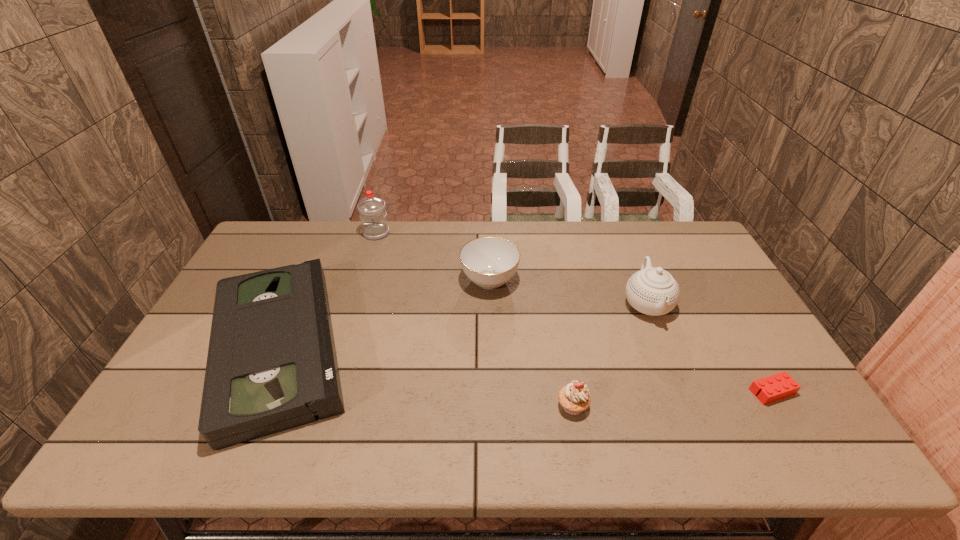
Locate an element on the screen. The height and width of the screenshot is (540, 960). object that is at the near left corner is located at coordinates coord(271,366).

Locate an element on the screen. vacant space at the far edge of the desktop is located at coordinates (419, 252).

This screenshot has height=540, width=960. I want to click on free space at the near edge, so click(x=305, y=449).

Where is `free space at the left edge`? free space at the left edge is located at coordinates (204, 383).

Where is `vacant space at the right edge of the desktop`? vacant space at the right edge of the desktop is located at coordinates (709, 313).

The width and height of the screenshot is (960, 540). Identify the location of free space between the fourth object from left to right and the right chinaware. (610, 355).

At what (x,y) coordinates should I click in order to perform the action: click on free space between the fifth tallest object and the water bottle. Please return your answer as a coordinate pair (x, y). Looking at the image, I should click on (328, 290).

Find the location of a particular element. This screenshot has height=540, width=960. free spot between the shortest object and the third object from right to left is located at coordinates (672, 399).

I want to click on vacant space that's between the second shortest object and the cupcake, so click(426, 377).

Find the location of a particular element. The width and height of the screenshot is (960, 540). vacant area that lies between the cupcake and the water bottle is located at coordinates (474, 320).